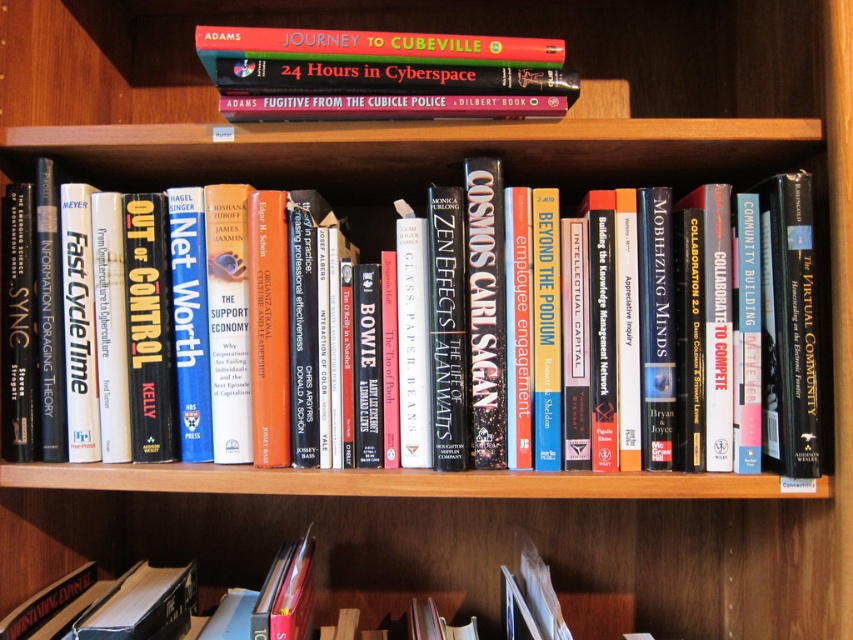
Question: Does hardcover book at center appear on the right side of hardcover book at upper center?

Choices:
 (A) yes
 (B) no

Answer: (A)

Question: Which point is closer to the camera?

Choices:
 (A) (366, 84)
 (B) (817, 296)

Answer: (A)

Question: Which point appears closest to the camera in this image?

Choices:
 (A) (456, 72)
 (B) (354, 164)

Answer: (A)

Question: Does hardcover book at center appear on the right side of hardcover book at upper center?

Choices:
 (A) yes
 (B) no

Answer: (A)

Question: Which point appears closest to the camera in this image?

Choices:
 (A) (279, 96)
 (B) (265, 180)

Answer: (A)

Question: Is hardcover book at center further to camera compared to hardcover book at upper center?

Choices:
 (A) no
 (B) yes

Answer: (B)